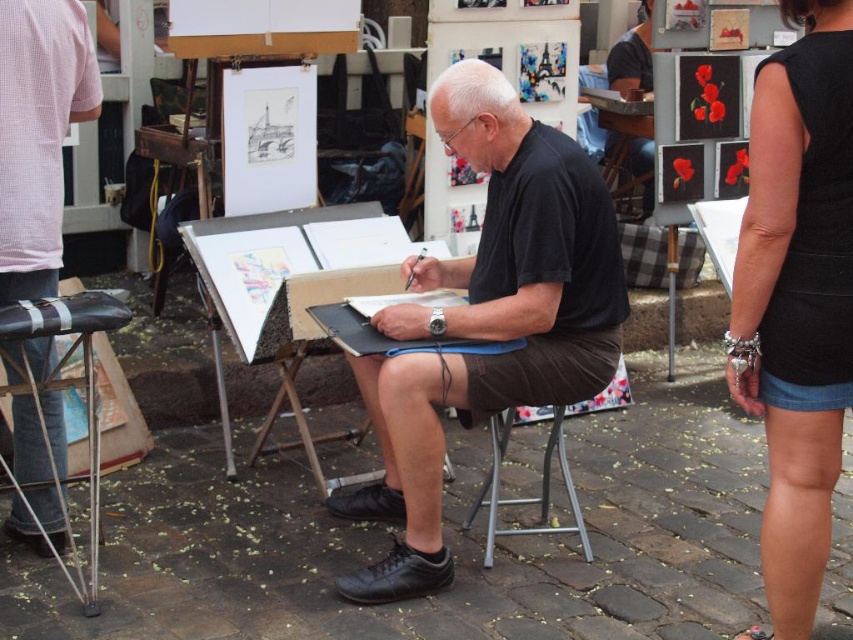
Based on the scene described, which object is taller between the matte black shirt at center and the wooden easel at center?

The matte black shirt at center is much taller than the wooden easel at center.

You are a photographer trying to capture the artist in the scene. Where exactly should you focus your camera to ensure the matte black shirt at center is perfectly framed?

You should focus your camera at point coordinates (38, 134) to capture the matte black shirt at center precisely.